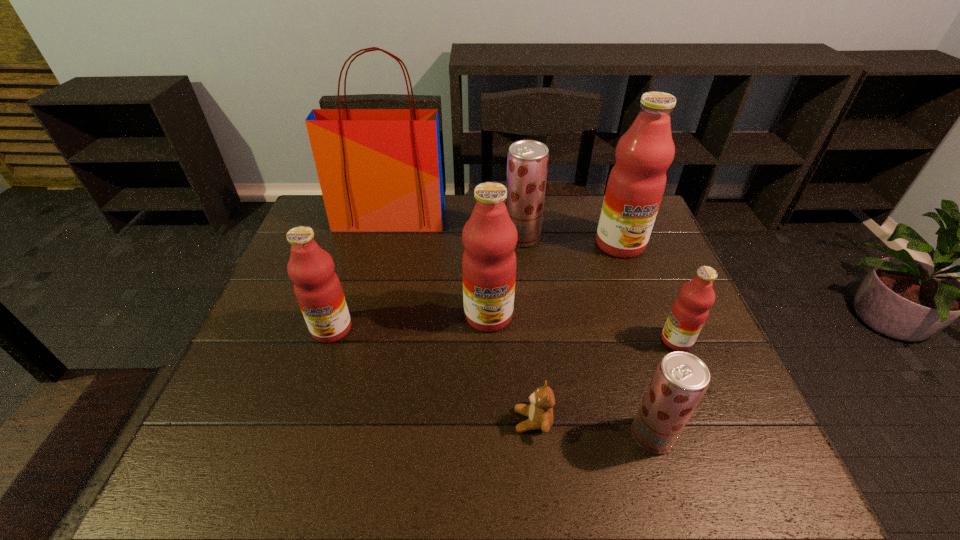
Identify the location of vacant region that satisfies the following two spatial constraints: 1. on the back side of the right strawberry fruit juice; 2. on the front-facing side of the teddy bear. This screenshot has height=540, width=960. (648, 421).

Find the location of a particular element. vacant space that satisfies the following two spatial constraints: 1. on the handle side of the blue shopping bag; 2. on the right side of the right strawberry fruit juice is located at coordinates (335, 435).